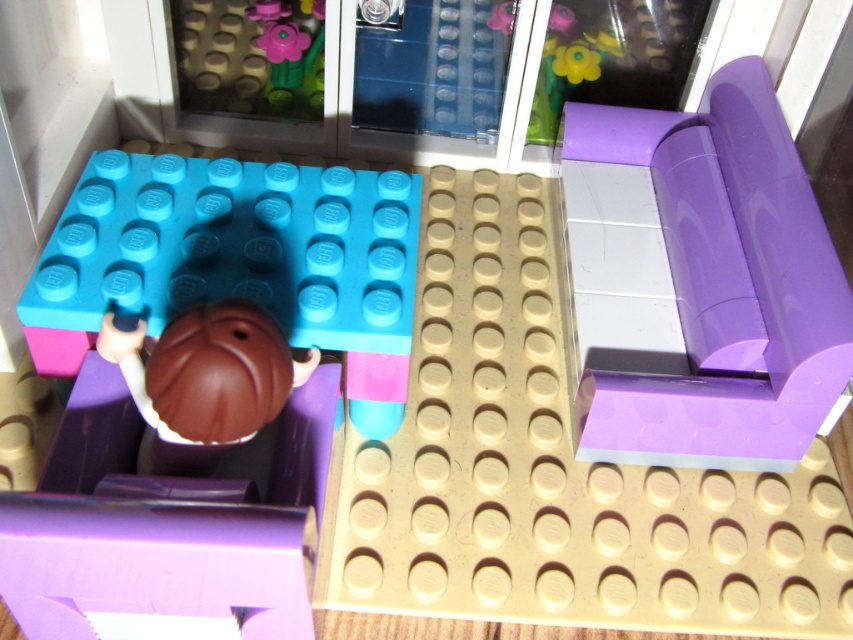
Does purple glossy couch at upper right have a larger size compared to matte blue plate at center?

Correct, purple glossy couch at upper right is larger in size than matte blue plate at center.

Can you confirm if purple glossy couch at upper right is positioned above matte blue plate at center?

Correct, purple glossy couch at upper right is located above matte blue plate at center.

Image resolution: width=853 pixels, height=640 pixels. What do you see at coordinates (723, 285) in the screenshot?
I see `purple glossy couch at upper right` at bounding box center [723, 285].

This screenshot has width=853, height=640. Find the location of `purple glossy couch at upper right`. purple glossy couch at upper right is located at coordinates (723, 285).